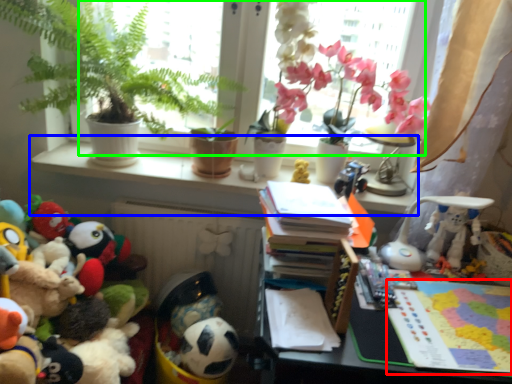
Question: Considering the real-world distances, which object is farthest from book (highlighted by a red box)? window sill (highlighted by a blue box) or window screen (highlighted by a green box)?

Choices:
 (A) window sill
 (B) window screen

Answer: (B)